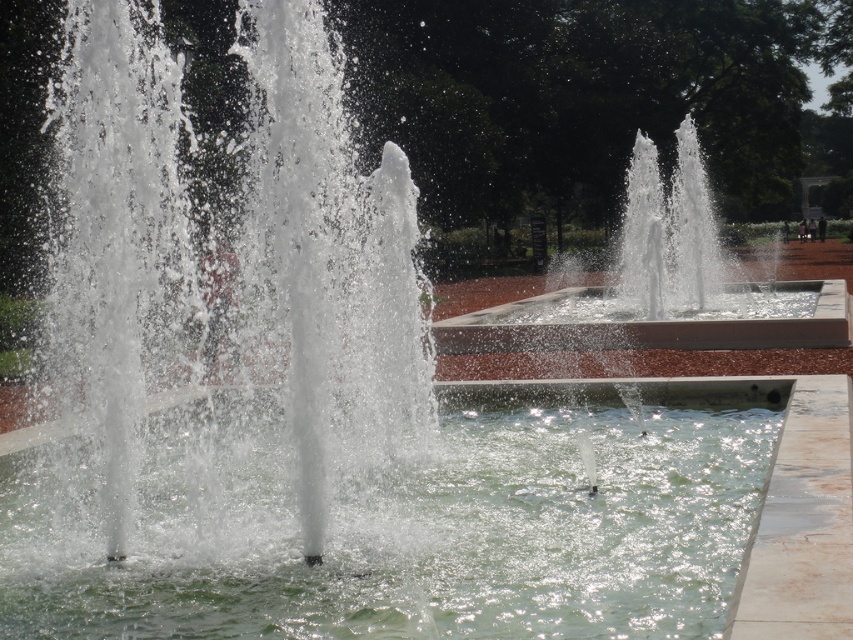
Question: Does clear liquid water at center have a greater width compared to white glossy water at center?

Choices:
 (A) yes
 (B) no

Answer: (B)

Question: Which point is farther to the camera?

Choices:
 (A) clear liquid water at center
 (B) white glossy water at center

Answer: (B)

Question: Does clear liquid water at center appear over white glossy water at center?

Choices:
 (A) no
 (B) yes

Answer: (A)

Question: Is clear liquid water at center to the left of white glossy water at center from the viewer's perspective?

Choices:
 (A) no
 (B) yes

Answer: (B)